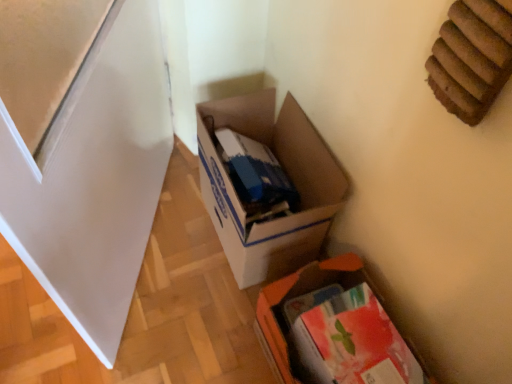
Question: From the image's perspective, relative to white cardboard box at center, which appears as the 1th box when viewed from the top, is orange fabric box at lower right, the first box in the bottom-to-top sequence, above or below?

Choices:
 (A) below
 (B) above

Answer: (A)

Question: Considering the positions of orange fabric box at lower right, the first box in the bottom-to-top sequence, and white cardboard box at center, which is the 2th box in bottom-to-top order, in the image, is orange fabric box at lower right, the first box in the bottom-to-top sequence, wider or thinner than white cardboard box at center, which is the 2th box in bottom-to-top order,?

Choices:
 (A) thin
 (B) wide

Answer: (A)

Question: Is orange fabric box at lower right, which ranks as the 2th box in top-to-bottom order, in front of or behind white cardboard box at center, which is the 2th box in bottom-to-top order, in the image?

Choices:
 (A) behind
 (B) front

Answer: (B)

Question: Is white cardboard box at center, which appears as the 1th box when viewed from the top, in front of or behind orange fabric box at lower right, which ranks as the 2th box in top-to-bottom order, in the image?

Choices:
 (A) front
 (B) behind

Answer: (B)

Question: Is white cardboard box at center, which is the 2th box in bottom-to-top order, taller or shorter than orange fabric box at lower right, the first box in the bottom-to-top sequence?

Choices:
 (A) short
 (B) tall

Answer: (B)

Question: Considering the positions of white cardboard box at center, which is the 2th box in bottom-to-top order, and orange fabric box at lower right, the first box in the bottom-to-top sequence, in the image, is white cardboard box at center, which is the 2th box in bottom-to-top order, wider or thinner than orange fabric box at lower right, the first box in the bottom-to-top sequence,?

Choices:
 (A) wide
 (B) thin

Answer: (A)

Question: Do you think white cardboard box at center, which is the 2th box in bottom-to-top order, is within orange fabric box at lower right, the first box in the bottom-to-top sequence, or outside of it?

Choices:
 (A) inside
 (B) outside

Answer: (B)